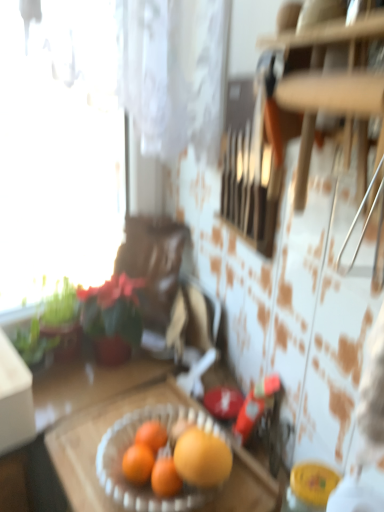
This screenshot has height=512, width=384. What do you see at coordinates (100, 441) in the screenshot?
I see `clear glass bowl at center` at bounding box center [100, 441].

In order to click on clear glass bowl at center in this screenshot , I will do `click(100, 441)`.

What is the approximate height of clear glass bowl at center?

clear glass bowl at center is 10.57 inches tall.

At what (x,y) coordinates should I click in order to perform the action: click on clear glass bowl at center. Please return your answer as a coordinate pair (x, y). Looking at the image, I should click on (100, 441).